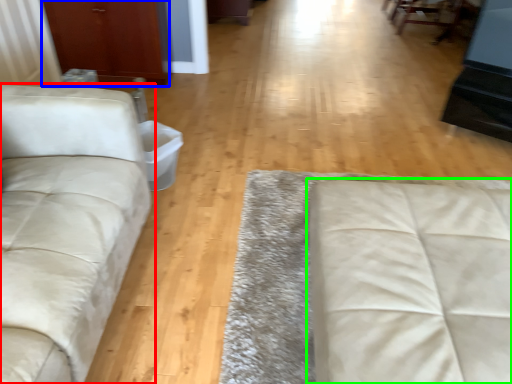
Question: Estimate the real-world distances between objects in this image. Which object is closer to studio couch (highlighted by a red box), armoire (highlighted by a blue box) or studio couch (highlighted by a green box)?

Choices:
 (A) armoire
 (B) studio couch

Answer: (B)